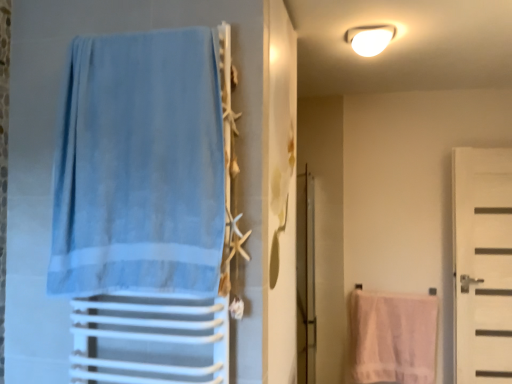
Question: Considering the positions of point (379, 316) and point (459, 321), is point (379, 316) closer or farther from the camera than point (459, 321)?

Choices:
 (A) farther
 (B) closer

Answer: (A)

Question: From a real-world perspective, is white textured towel at lower right above or below white matte door at right?

Choices:
 (A) below
 (B) above

Answer: (A)

Question: Which of these objects is positioned closest to the light blue fabric towel at left?

Choices:
 (A) clear glass screen door at center
 (B) white matte door at right
 (C) white glossy light fixture at upper center
 (D) white textured towel at lower right

Answer: (A)

Question: Based on their relative distances, which object is farther from the white matte door at right?

Choices:
 (A) light blue fabric towel at left
 (B) white glossy light fixture at upper center
 (C) clear glass screen door at center
 (D) white textured towel at lower right

Answer: (A)